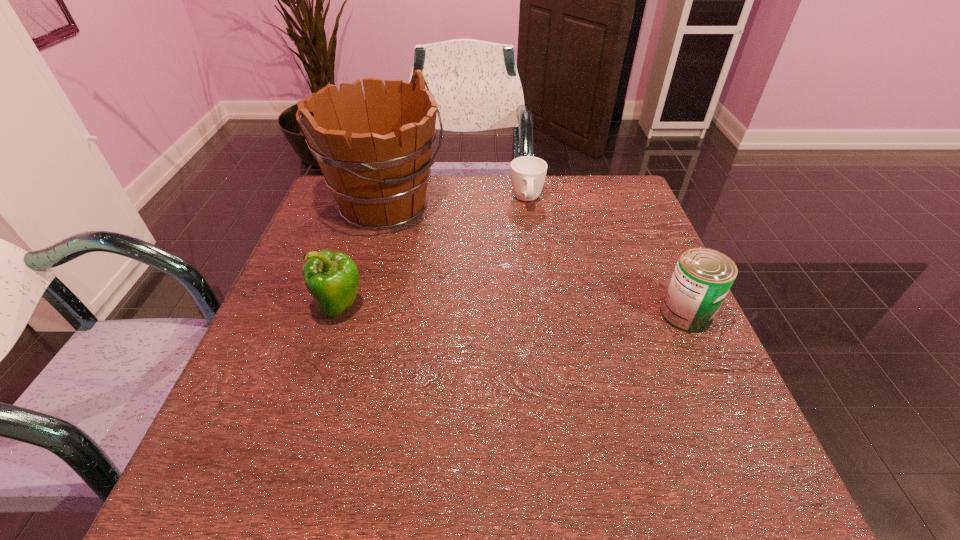
This screenshot has height=540, width=960. In the image, there is a desktop. What are the coordinates of `vacant space at the far edge` in the screenshot? It's located at (492, 197).

Where is `vacant space at the near edge of the desktop`? The width and height of the screenshot is (960, 540). vacant space at the near edge of the desktop is located at coordinates (367, 429).

Where is `vacant space at the left edge of the desktop`? vacant space at the left edge of the desktop is located at coordinates (293, 329).

Identify the location of vacant space at the right edge. (659, 324).

Where is `free space at the far left corner`? The image size is (960, 540). free space at the far left corner is located at coordinates (325, 205).

Where is `free space at the far right corner of the desktop`? The image size is (960, 540). free space at the far right corner of the desktop is located at coordinates [600, 198].

Image resolution: width=960 pixels, height=540 pixels. I want to click on vacant area at the near right corner of the desktop, so (722, 432).

Where is `free area in between the can and the tallest object`? The width and height of the screenshot is (960, 540). free area in between the can and the tallest object is located at coordinates point(536,260).

At what (x,y) coordinates should I click in order to perform the action: click on free space that is in between the rightmost object and the shortest object. Please return your answer as a coordinate pair (x, y). This screenshot has width=960, height=540. Looking at the image, I should click on (607, 257).

At what (x,y) coordinates should I click in order to perform the action: click on vacant area that lies between the tallest object and the second shortest object. Please return your answer as a coordinate pair (x, y). Looking at the image, I should click on (536, 260).